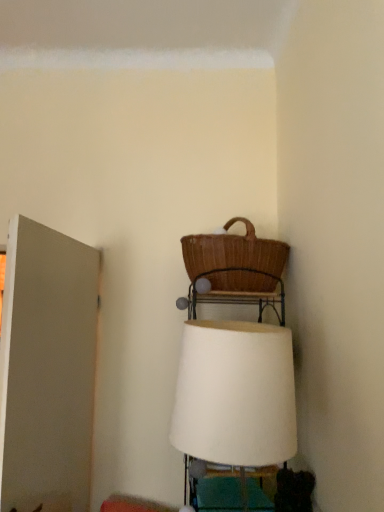
Question: Does brown wicker picnic basket at upper center appear on the right side of white matte door at left?

Choices:
 (A) yes
 (B) no

Answer: (A)

Question: Is brown wicker picnic basket at upper center positioned beyond the bounds of white matte door at left?

Choices:
 (A) no
 (B) yes

Answer: (B)

Question: Is brown wicker picnic basket at upper center at the left side of white matte door at left?

Choices:
 (A) no
 (B) yes

Answer: (A)

Question: Is brown wicker picnic basket at upper center further to the viewer compared to white matte door at left?

Choices:
 (A) no
 (B) yes

Answer: (B)

Question: Considering the relative sizes of brown wicker picnic basket at upper center and white matte door at left in the image provided, is brown wicker picnic basket at upper center thinner than white matte door at left?

Choices:
 (A) no
 (B) yes

Answer: (A)

Question: Can you confirm if brown wicker picnic basket at upper center is bigger than white matte door at left?

Choices:
 (A) no
 (B) yes

Answer: (A)

Question: Could white fabric lampshade at center be considered to be inside brown wicker picnic basket at upper center?

Choices:
 (A) no
 (B) yes

Answer: (A)

Question: Is brown wicker picnic basket at upper center closer to the viewer compared to white fabric lampshade at center?

Choices:
 (A) yes
 (B) no

Answer: (B)

Question: Is white fabric lampshade at center at the back of brown wicker picnic basket at upper center?

Choices:
 (A) yes
 (B) no

Answer: (B)

Question: From the image's perspective, is brown wicker picnic basket at upper center under white fabric lampshade at center?

Choices:
 (A) yes
 (B) no

Answer: (B)

Question: From a real-world perspective, does brown wicker picnic basket at upper center stand above white fabric lampshade at center?

Choices:
 (A) yes
 (B) no

Answer: (A)

Question: Is brown wicker picnic basket at upper center placed right next to white fabric lampshade at center?

Choices:
 (A) yes
 (B) no

Answer: (B)

Question: Can you confirm if white fabric lampshade at center is bigger than white matte door at left?

Choices:
 (A) yes
 (B) no

Answer: (B)